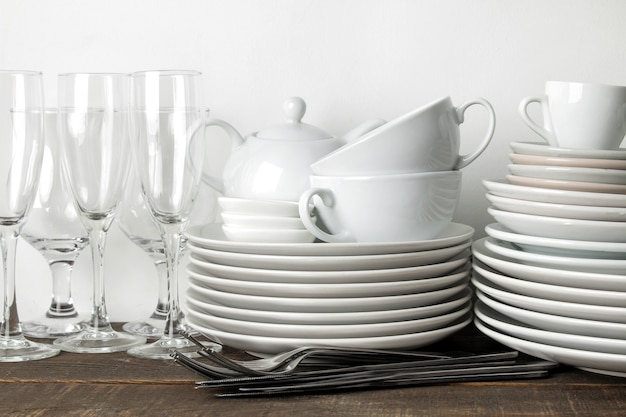
Where is `glass cups`? glass cups is located at coordinates (175, 184), (143, 219), (105, 208), (69, 230), (14, 198).